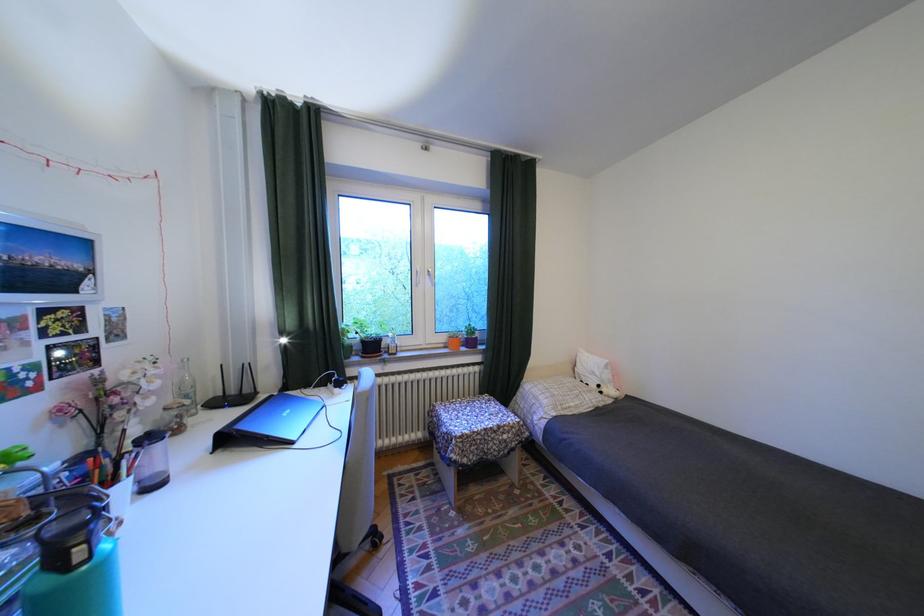
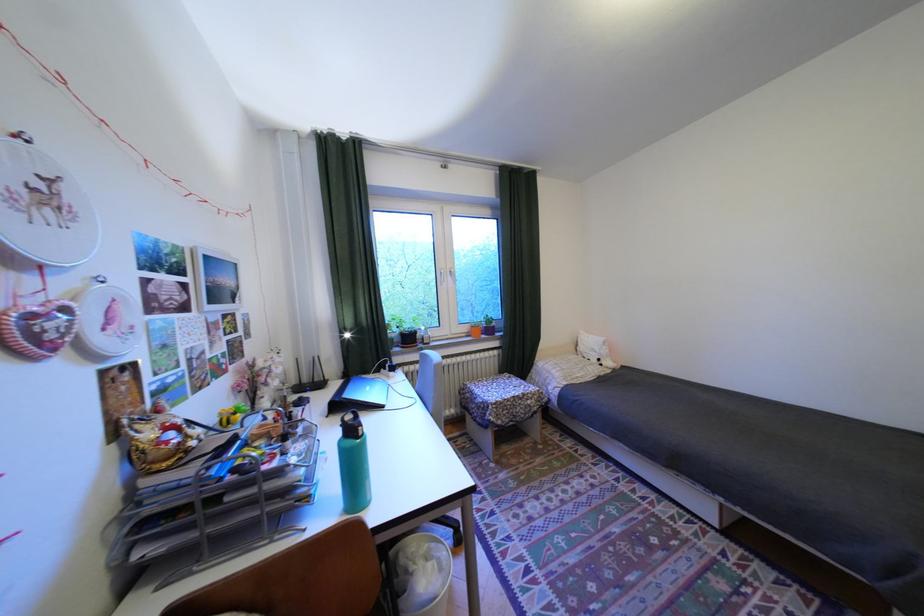
Locate, in the second image, the point that corresponds to the point at 295,333 in the first image.

(354, 330)